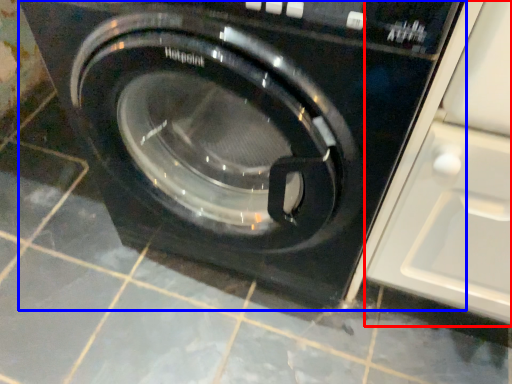
Question: Which object is closer to the camera taking this photo, glass door (highlighted by a red box) or washing machine (highlighted by a blue box)?

Choices:
 (A) glass door
 (B) washing machine

Answer: (A)